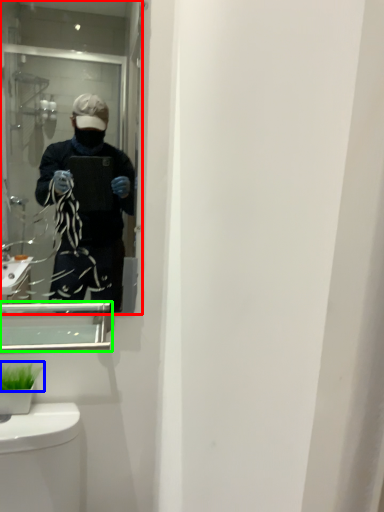
Question: Based on their relative distances, which object is farther from mirror (highlighted by a red box)? Choose from plant (highlighted by a blue box) and medicine cabinet (highlighted by a green box).

Choices:
 (A) plant
 (B) medicine cabinet

Answer: (A)